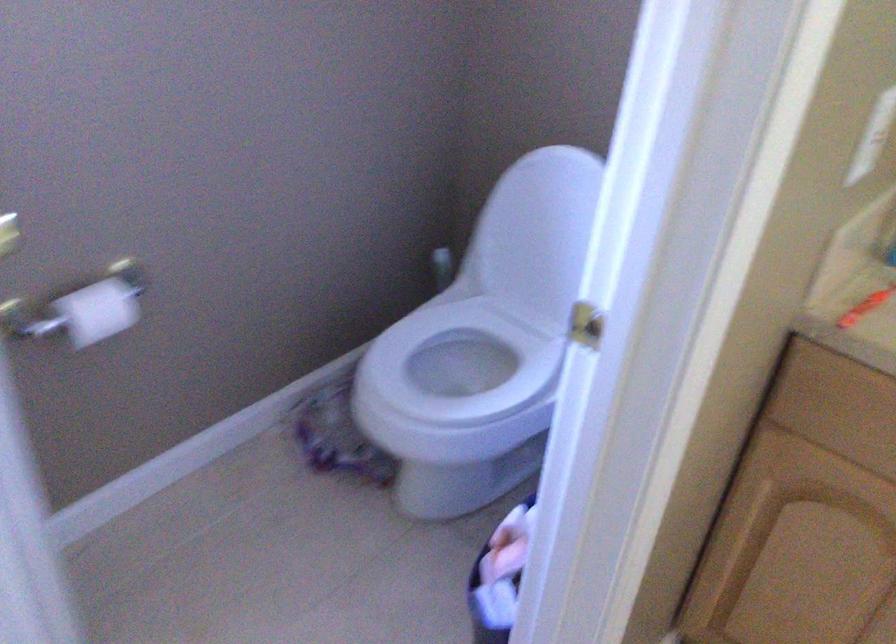
You are a GUI agent. You are given a task and a screenshot of the screen. Output one action in this format:
    pyautogui.click(x=<x>, y=<y>)
    Task: Click on the white toilet lid
    
    Given the screenshot: What is the action you would take?
    (538, 228)